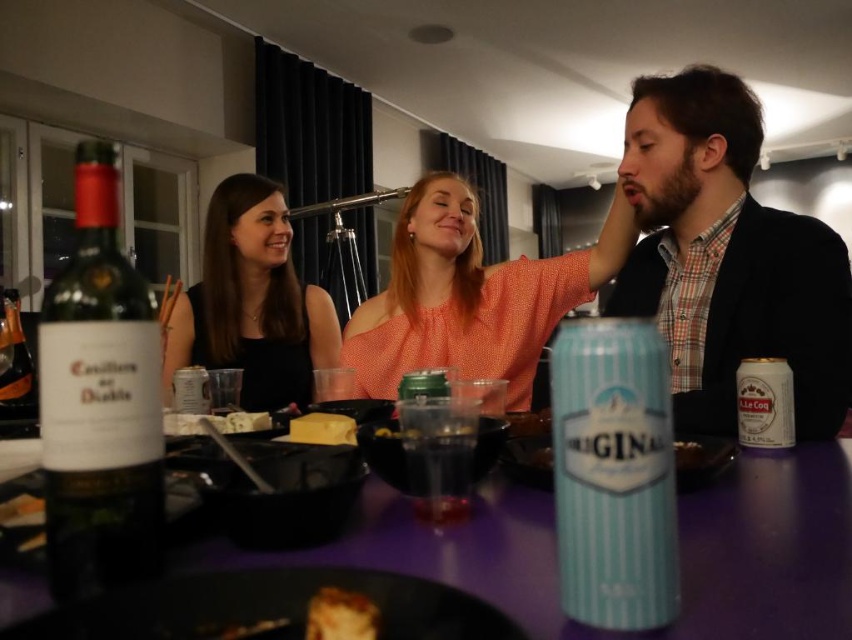
Question: Based on their relative distances, which object is nearer to the orange dotted blouse at center?

Choices:
 (A) white creamy cheese at center
 (B) checkered fabric shirt at center
 (C) purple glossy table at center
 (D) yellow cheese at center

Answer: (B)

Question: Among these objects, which one is farthest from the camera?

Choices:
 (A) light blue plastic can at center
 (B) white creamy cheese at center

Answer: (B)

Question: Does light blue plastic can at center come in front of golden crispy bread at center?

Choices:
 (A) yes
 (B) no

Answer: (B)

Question: Where is purple glossy table at center located in relation to yellow cheese at center in the image?

Choices:
 (A) below
 (B) above

Answer: (A)

Question: Which object is positioned farthest from the black matte dress at center?

Choices:
 (A) checkered fabric shirt at center
 (B) green glass bottle at left
 (C) purple glossy table at center

Answer: (B)

Question: Is checkered fabric shirt at center below white creamy cheese at center?

Choices:
 (A) yes
 (B) no

Answer: (B)